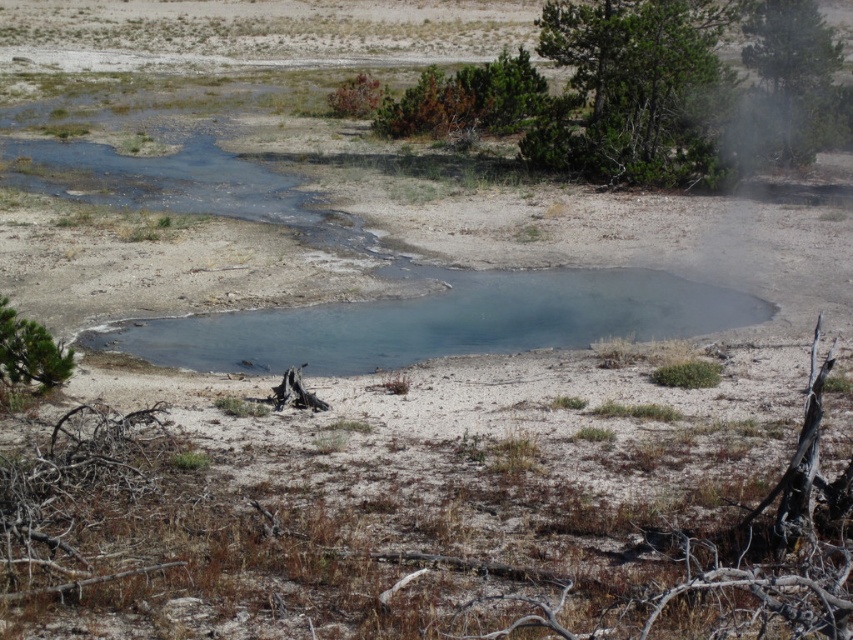
Measure the distance from blue clear water at center to green textured tree at upper right.

14.71 meters

In the scene shown: Who is shorter, blue clear water at center or green textured tree at upper right?

Standing shorter between the two is blue clear water at center.

From the picture: Who is more forward, (207, 362) or (701, 29)?

Point (207, 362) is in front.

The width and height of the screenshot is (853, 640). Find the location of `blue clear water at center`. blue clear water at center is located at coordinates (440, 323).

Is green leafy tree at upper right behind green matte tree at lower left?

Yes, green leafy tree at upper right is behind green matte tree at lower left.

Between green leafy tree at upper right and green matte tree at lower left, which one is positioned higher?

green leafy tree at upper right is higher up.

What do you see at coordinates (792, 68) in the screenshot? I see `green leafy tree at upper right` at bounding box center [792, 68].

Locate an element on the screen. The width and height of the screenshot is (853, 640). green leafy tree at upper right is located at coordinates (792, 68).

Does blue clear water at center appear on the left side of green matte tree at lower left?

No, blue clear water at center is not to the left of green matte tree at lower left.

Is blue clear water at center positioned behind green matte tree at lower left?

Yes, blue clear water at center is further from the viewer.

Between point (252, 326) and point (15, 321), which one is positioned in front?

Point (15, 321) is in front.

What are the coordinates of `blue clear water at center` in the screenshot? It's located at (440, 323).